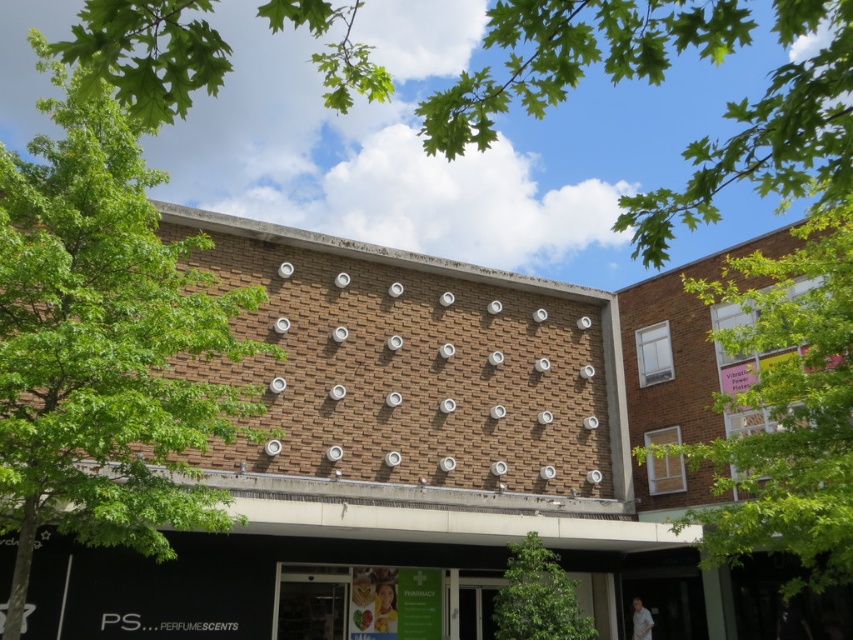
Question: Is green leafy tree at upper center to the left of green leafy tree at lower center from the viewer's perspective?

Choices:
 (A) no
 (B) yes

Answer: (B)

Question: Which of the following is the closest to the observer?

Choices:
 (A) tap(695, 280)
 (B) tap(544, 560)
 (C) tap(79, 288)
 (D) tap(779, 22)

Answer: (D)

Question: Which of the following is the closest to the observer?

Choices:
 (A) (567, 612)
 (B) (740, 298)
 (C) (132, 420)

Answer: (C)

Question: Can you confirm if green leafy tree at upper left is positioned above green leafy tree at upper right?

Choices:
 (A) no
 (B) yes

Answer: (B)

Question: Estimate the real-world distances between objects in this image. Which object is closer to the green leafy tree at lower center?

Choices:
 (A) green leafy tree at upper center
 (B) green leafy tree at upper right
 (C) green leafy tree at upper left

Answer: (B)

Question: Can you confirm if green leafy tree at upper left is bigger than green leafy tree at upper right?

Choices:
 (A) no
 (B) yes

Answer: (A)